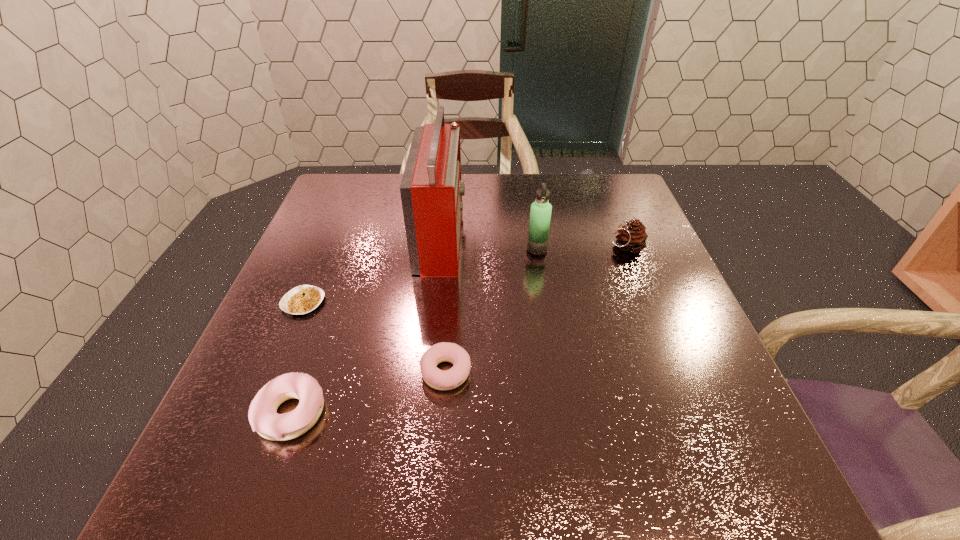
Where is `free point that keeps the doughnuts evenly spaced on the right`? Image resolution: width=960 pixels, height=540 pixels. free point that keeps the doughnuts evenly spaced on the right is located at coordinates (579, 337).